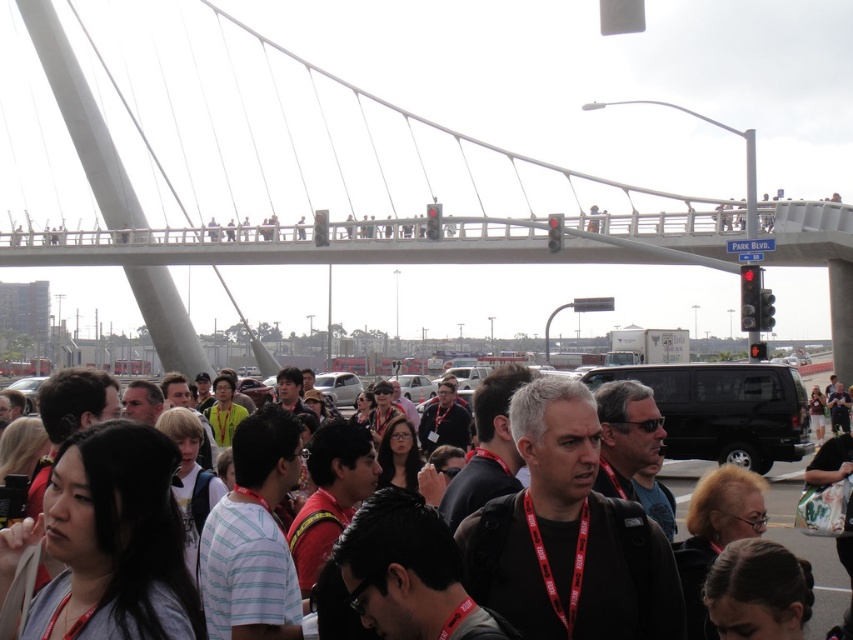
You are standing in the bustling urban scene described. You need to locate the white concrete pedestrian bridge at upper center. According to the coordinates provided, where should you look to find it?

The white concrete pedestrian bridge at upper center is located at the coordinates point (x=412, y=156).

You are a delivery drone operator. Your drone needs to fly from the white concrete pedestrian bridge at upper center to the matte black backpack at center. According to the scene, what is the minimum distance your drone must cover to reach the destination?

The minimum distance your drone must cover to reach the matte black backpack at center from the white concrete pedestrian bridge at upper center is 93.81 meters.